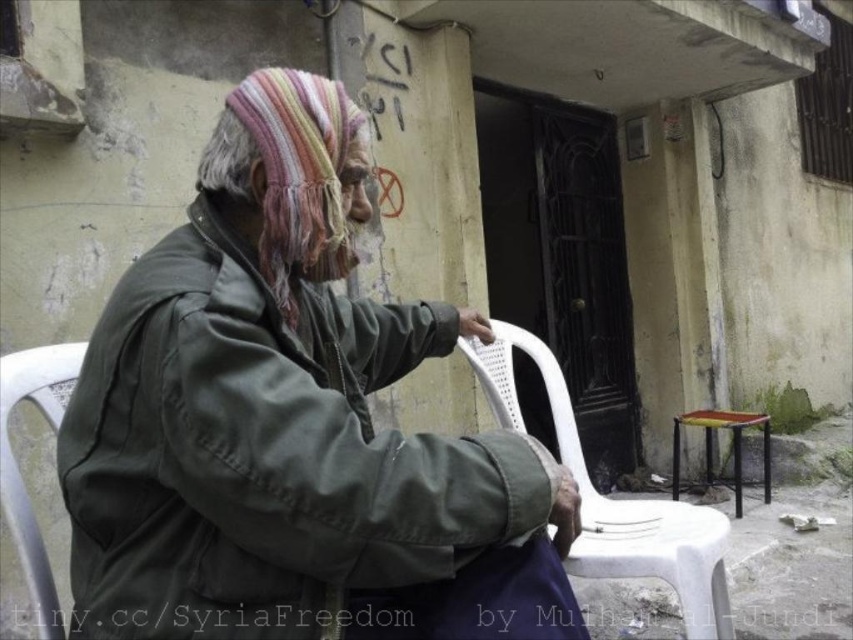
Question: Among these objects, which one is farthest from the camera?

Choices:
 (A) yellow plastic stool at lower right
 (B) white plastic chair at lower right

Answer: (A)

Question: Does green matte jacket at center appear over white plastic chair at lower right?

Choices:
 (A) yes
 (B) no

Answer: (A)

Question: Which object is the farthest from the white plastic chair at lower left?

Choices:
 (A) yellow plastic stool at lower right
 (B) white plastic chair at lower right
 (C) green matte jacket at center

Answer: (A)

Question: Based on their relative distances, which object is nearer to the green matte jacket at center?

Choices:
 (A) white plastic chair at lower left
 (B) yellow plastic stool at lower right

Answer: (A)

Question: Considering the relative positions of white plastic chair at lower right and yellow plastic stool at lower right in the image provided, where is white plastic chair at lower right located with respect to yellow plastic stool at lower right?

Choices:
 (A) above
 (B) below

Answer: (A)

Question: Is white plastic chair at lower right to the left of yellow plastic stool at lower right from the viewer's perspective?

Choices:
 (A) yes
 (B) no

Answer: (A)